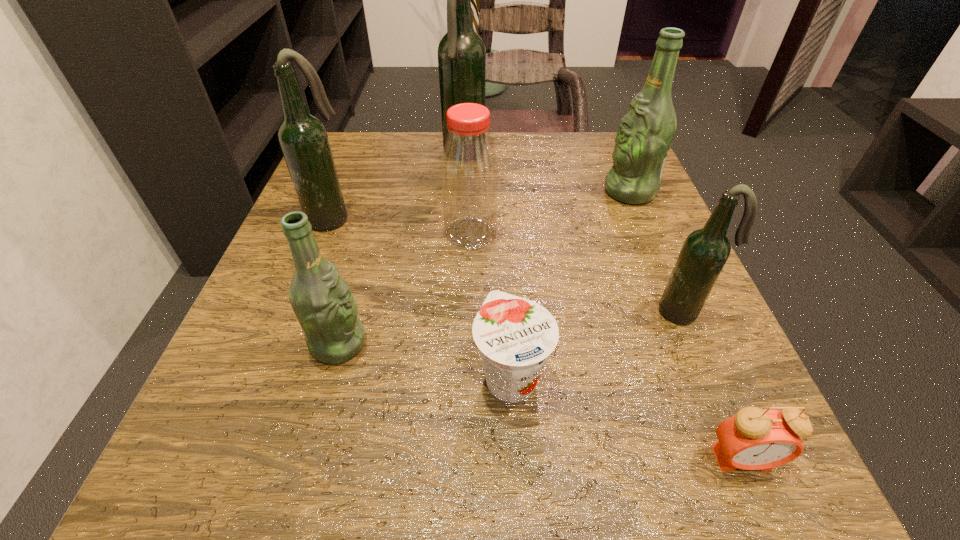
Locate an element on the screen. This screenshot has height=540, width=960. the nearer green beer bottle is located at coordinates (322, 301).

This screenshot has width=960, height=540. Find the location of `alarm clock`. alarm clock is located at coordinates (754, 439).

Identify the location of the nearest object. The image size is (960, 540). (754, 439).

Find the location of `yogurt`. yogurt is located at coordinates (515, 336).

Identify the location of vacant space situated 0.130m on the left of the farthest object. (386, 156).

At what (x,y) coordinates should I click in order to perform the action: click on vacant space situated on the surface of the farther green beer bottle. Please return your answer as a coordinate pair (x, y). Looking at the image, I should click on (456, 192).

Find the location of a particular element. This screenshot has width=960, height=540. vacant space situated on the surface of the farther green beer bottle is located at coordinates (545, 192).

Find the location of a particular element. vacant space located 0.320m on the surface of the farther green beer bottle is located at coordinates (446, 192).

Locate an element on the screen. vacant space located on the right of the second biggest dark beer bottle is located at coordinates (485, 218).

You are a GUI agent. You are given a task and a screenshot of the screen. Output one action in this format:
    pyautogui.click(x=<x>, y=<y>)
    Task: Click on the vacant region located on the back of the bottle
    This screenshot has height=540, width=960.
    Given the screenshot: What is the action you would take?
    pyautogui.click(x=472, y=151)